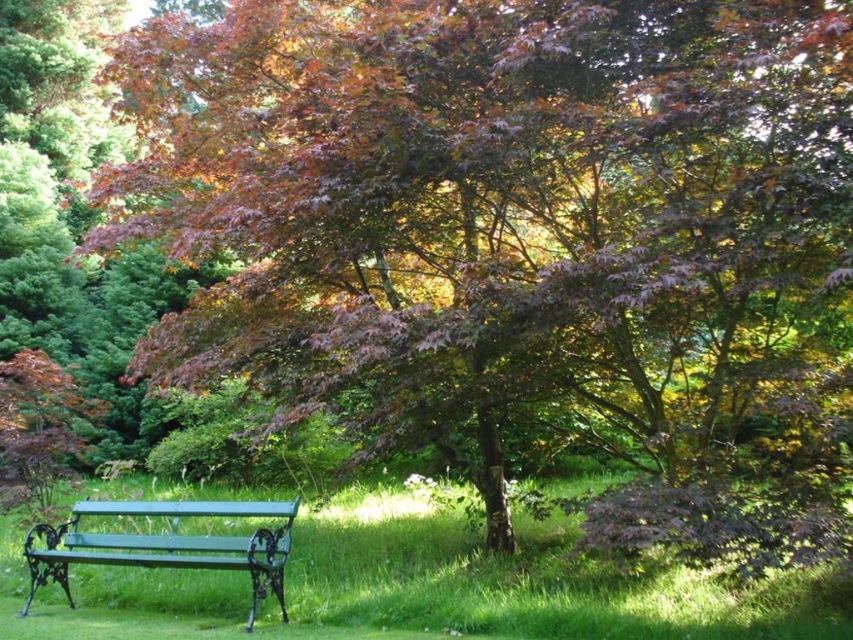
Who is lower down, green grass at lower left or green painted metal bench at lower left?

green grass at lower left

Where is `green grass at lower left`? The width and height of the screenshot is (853, 640). green grass at lower left is located at coordinates (525, 582).

Is point (299, 540) farther from viewer compared to point (285, 502)?

Yes.

In order to click on green grass at lower left in this screenshot , I will do `click(525, 582)`.